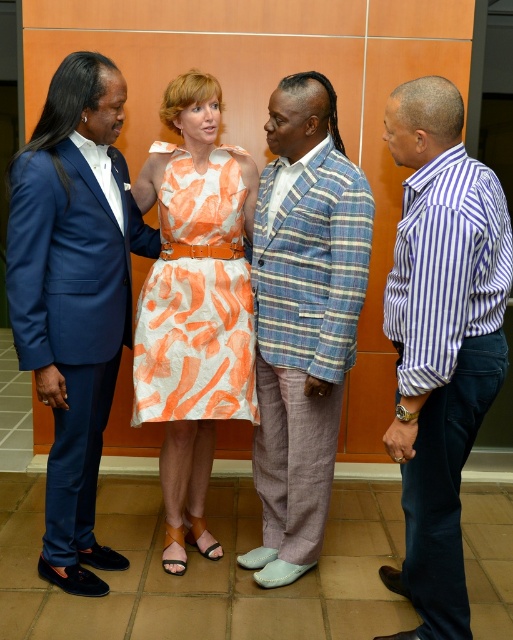
This screenshot has width=513, height=640. Describe the element at coordinates (441, 339) in the screenshot. I see `purple striped shirt at right` at that location.

Does point (495, 253) come farther from viewer compared to point (205, 380)?

No, (495, 253) is closer to viewer.

Does point (420, 401) come farther from viewer compared to point (204, 410)?

No.

The image size is (513, 640). Identify the location of purple striped shirt at right. (441, 339).

Is plaid fabric blazer at center shorter than orange printed fabric dress at center?

In fact, plaid fabric blazer at center may be taller than orange printed fabric dress at center.

The height and width of the screenshot is (640, 513). I want to click on plaid fabric blazer at center, so click(x=303, y=317).

Is point (309, 186) behind point (166, 406)?

That is False.

Locate an element on the screen. The image size is (513, 640). plaid fabric blazer at center is located at coordinates (303, 317).

Who is positioned more to the left, matte blue suit at left or plaid fabric blazer at center?

From the viewer's perspective, matte blue suit at left appears more on the left side.

Measure the distance between matte blue suit at left and plaid fabric blazer at center.

matte blue suit at left is 26.49 inches away from plaid fabric blazer at center.

Is point (101, 122) positioned after point (313, 157)?

No, it is not.

Image resolution: width=513 pixels, height=640 pixels. Identify the location of matte blue suit at left. (74, 296).